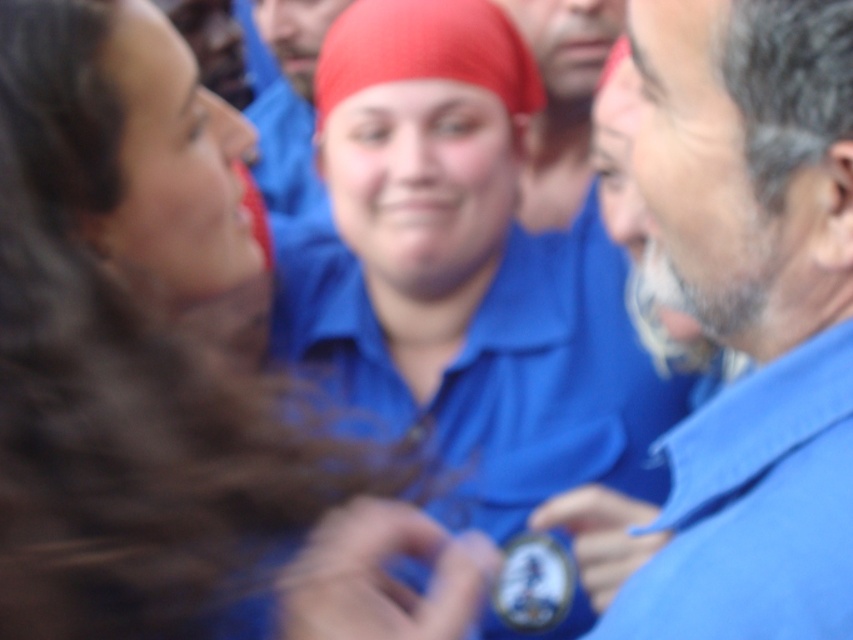
How far apart are matte blue shirt at center and blue fabric shirt at right?

33.80 centimeters

Can you confirm if matte blue shirt at center is smaller than blue fabric shirt at right?

Incorrect, matte blue shirt at center is not smaller in size than blue fabric shirt at right.

Where is `matte blue shirt at center`? This screenshot has height=640, width=853. matte blue shirt at center is located at coordinates click(x=161, y=371).

Locate an element on the screen. matte blue shirt at center is located at coordinates [161, 371].

Does point (370, 268) lie behind point (723, 236)?

Yes.

Does blue cotton shirt at center appear under blue fabric shirt at right?

Indeed, blue cotton shirt at center is positioned under blue fabric shirt at right.

Is point (370, 257) farther from viewer compared to point (741, 584)?

That is True.

The width and height of the screenshot is (853, 640). Identify the location of blue cotton shirt at center. (461, 273).

Between point (4, 324) and point (367, 256), which one is positioned in front?

Point (4, 324)

Is matte blue shirt at center to the right of blue cotton shirt at center from the viewer's perspective?

No, matte blue shirt at center is not to the right of blue cotton shirt at center.

Locate an element on the screen. Image resolution: width=853 pixels, height=640 pixels. matte blue shirt at center is located at coordinates [x=161, y=371].